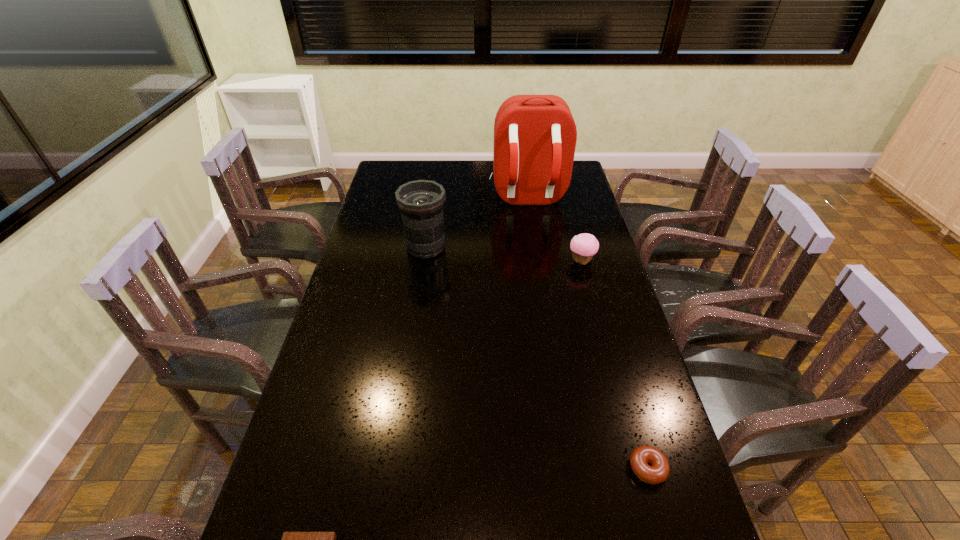
This screenshot has width=960, height=540. Find the location of `backpack`. backpack is located at coordinates (535, 136).

Locate an element on the screen. This screenshot has height=540, width=960. the tallest object is located at coordinates (535, 136).

Locate an element on the screen. the second object from left to right is located at coordinates (421, 202).

You are a GUI agent. You are given a task and a screenshot of the screen. Output one action in this format:
    pyautogui.click(x=<x>, y=<y>)
    Task: Click on the telephoto lens
    This screenshot has width=960, height=540.
    Given the screenshot: What is the action you would take?
    pyautogui.click(x=421, y=202)

Image resolution: width=960 pixels, height=540 pixels. I want to click on the third tallest object, so click(x=583, y=246).

Locate an element on the screen. This screenshot has height=540, width=960. the second nearest object is located at coordinates pos(659,471).

The height and width of the screenshot is (540, 960). What are the coordinates of `the fourth tallest object` in the screenshot? It's located at (659, 471).

The width and height of the screenshot is (960, 540). What are the coordinates of `free spot located 0.370m on the strap side of the farthest object` in the screenshot? It's located at (540, 281).

Locate an element on the screen. This screenshot has width=960, height=540. vacant region located on the front of the second object from left to right is located at coordinates (420, 294).

Identify the location of vacant area situated on the back of the cupcake. (572, 224).